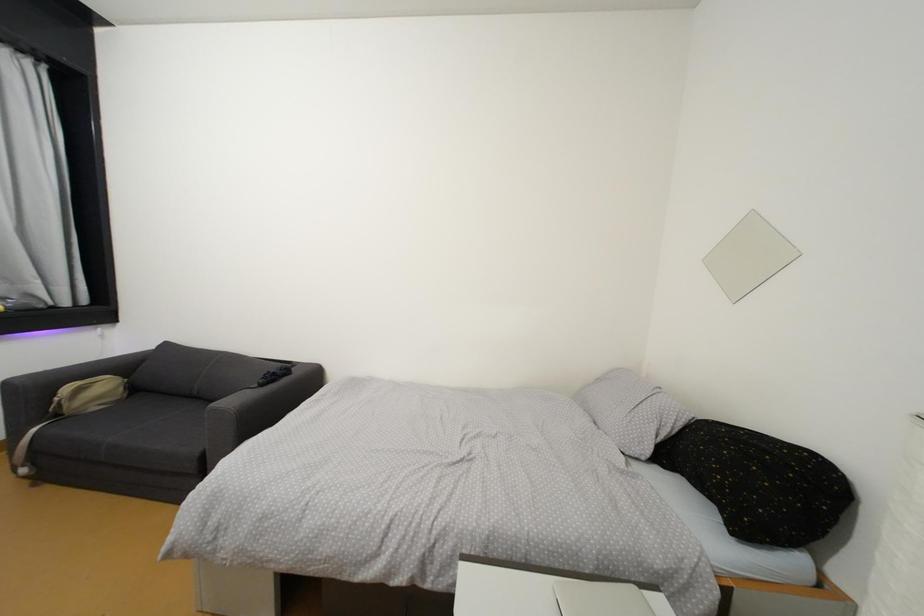
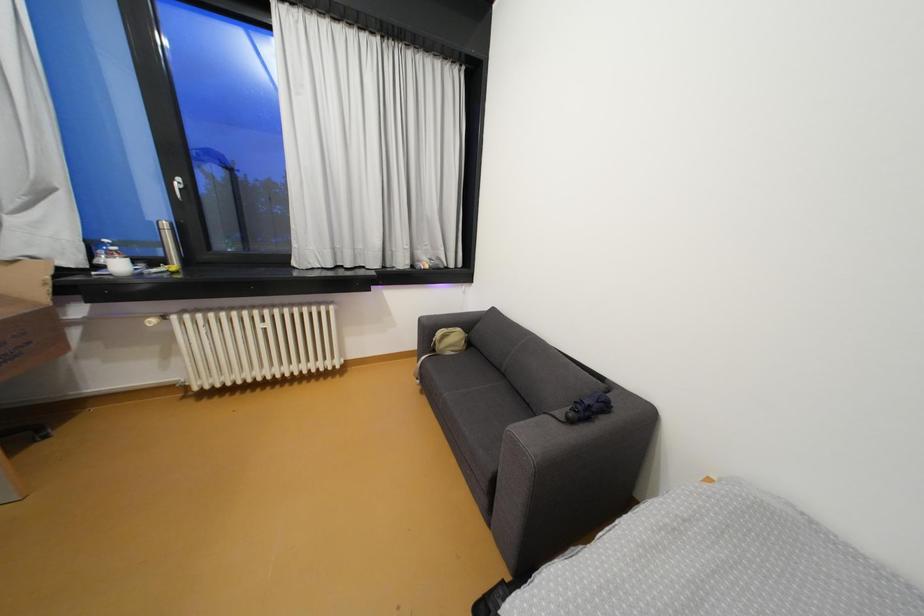
Question: How did the camera likely rotate?

Choices:
 (A) Left
 (B) Right
 (C) Up
 (D) Down

Answer: (A)